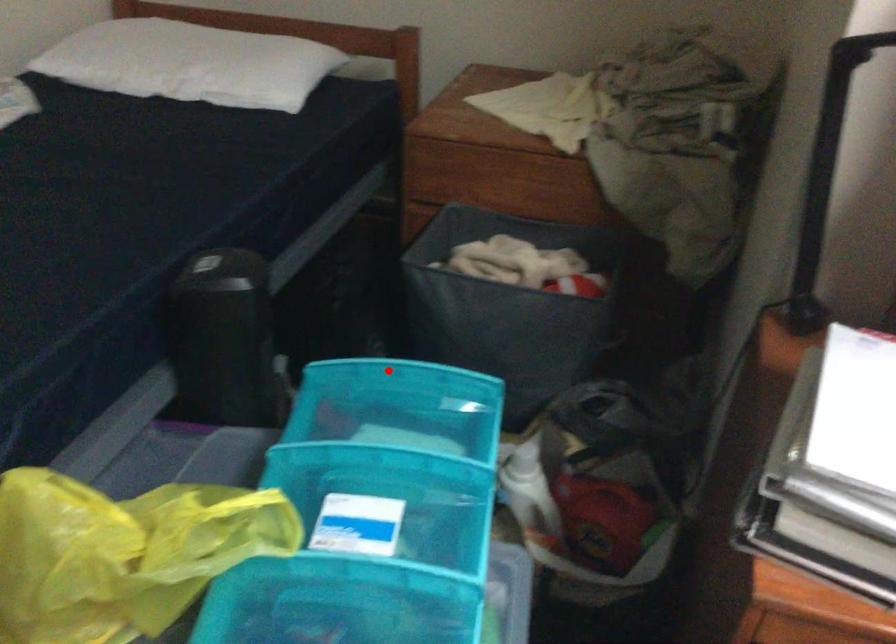
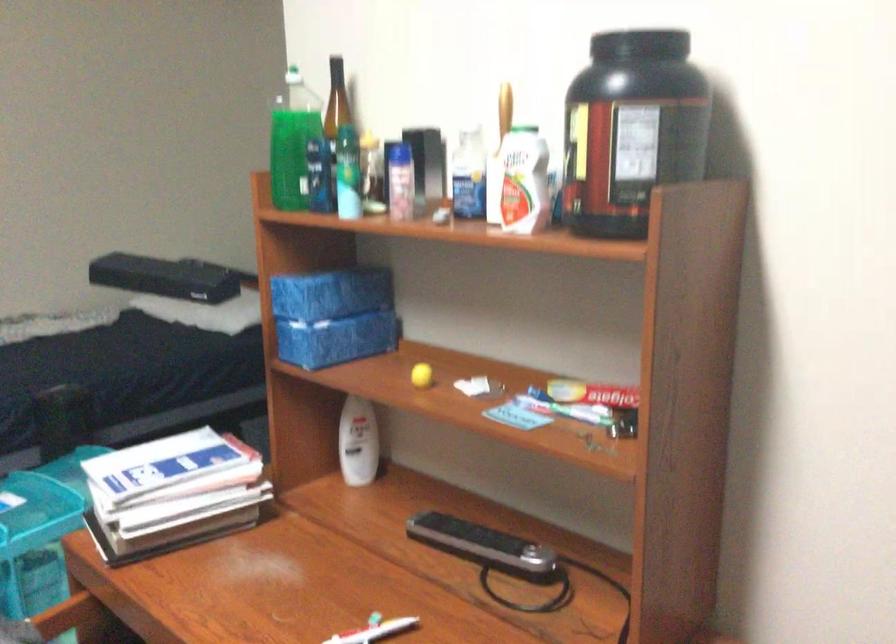
Question: I am providing you with two images of the same scene from different viewpoints. A red point is marked on the first image. Is the red point's position out of view in image 2?

Choices:
 (A) Yes
 (B) No

Answer: (A)